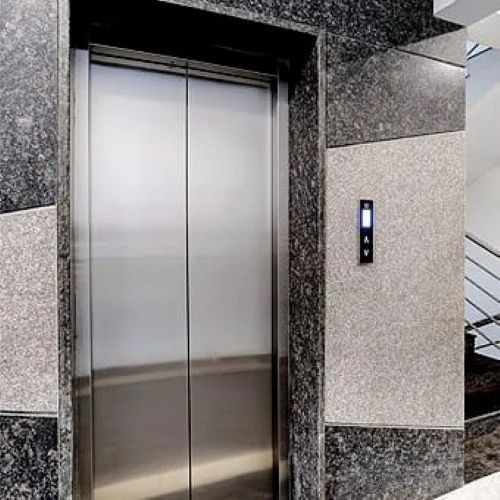
Where is `the top right edge of door`? the top right edge of door is located at coordinates (x=279, y=78).